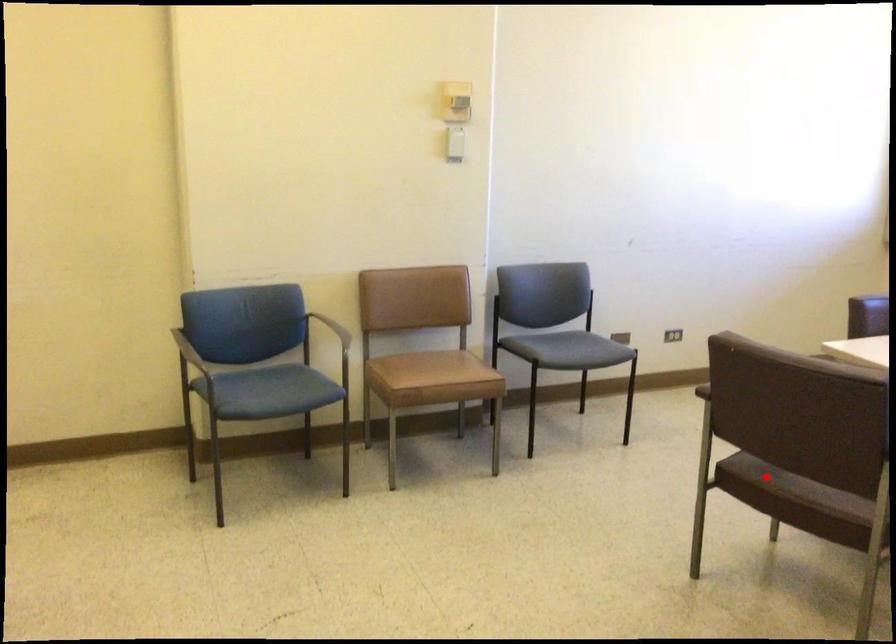
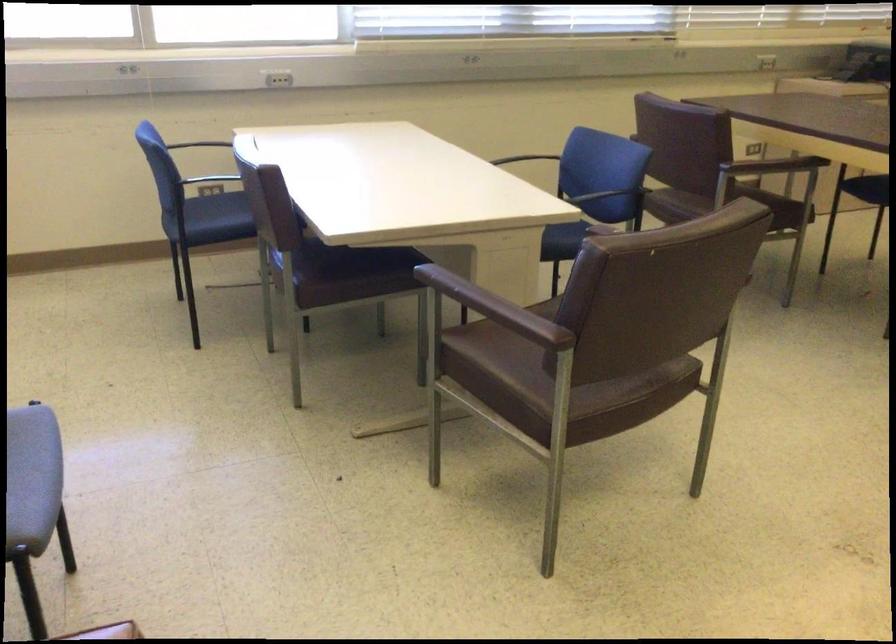
Question: I am providing you with two images of the same scene from different viewpoints. Given a red point in image1, look at the same physical point in image2. Is it:

Choices:
 (A) Closer to the viewpoint
 (B) Farther from the viewpoint

Answer: (A)